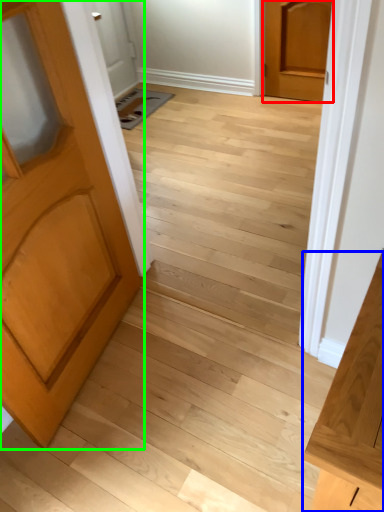
Question: Which object is positioned closest to door (highlighted by a red box)? Select from vanity (highlighted by a blue box) and door (highlighted by a green box).

Choices:
 (A) vanity
 (B) door

Answer: (B)